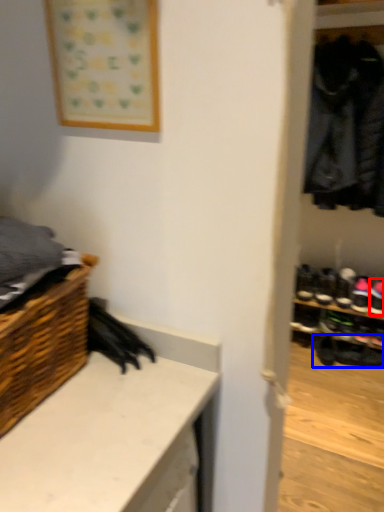
Question: Which object appears farthest to the camera in this image, footwear (highlighted by a red box) or footwear (highlighted by a blue box)?

Choices:
 (A) footwear
 (B) footwear

Answer: (B)